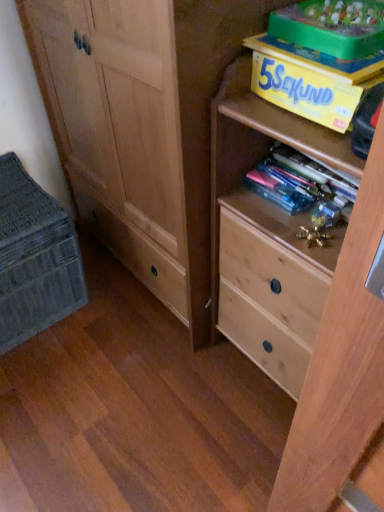
Question: Considering the relative sizes of translucent plastic books at center, placed as the 1th book when sorted from bottom to top, and green plastic storage box at upper right in the image provided, is translucent plastic books at center, placed as the 1th book when sorted from bottom to top, smaller than green plastic storage box at upper right?

Choices:
 (A) no
 (B) yes

Answer: (B)

Question: From a real-world perspective, is translucent plastic books at center, which is counted as the 2th book, starting from the top, on top of green plastic storage box at upper right?

Choices:
 (A) yes
 (B) no

Answer: (B)

Question: Is translucent plastic books at center, placed as the 1th book when sorted from bottom to top, aimed at green plastic storage box at upper right?

Choices:
 (A) yes
 (B) no

Answer: (B)

Question: Can you confirm if translucent plastic books at center, placed as the 1th book when sorted from bottom to top, is thinner than green plastic storage box at upper right?

Choices:
 (A) yes
 (B) no

Answer: (A)

Question: Can you confirm if translucent plastic books at center, which is counted as the 2th book, starting from the top, is shorter than green plastic storage box at upper right?

Choices:
 (A) no
 (B) yes

Answer: (B)

Question: From the image's perspective, is woven fabric basket at lower left positioned above or below translucent plastic books at center, placed as the 1th book when sorted from bottom to top?

Choices:
 (A) above
 (B) below

Answer: (B)

Question: In terms of width, does woven fabric basket at lower left look wider or thinner when compared to translucent plastic books at center, placed as the 1th book when sorted from bottom to top?

Choices:
 (A) wide
 (B) thin

Answer: (A)

Question: Relative to translucent plastic books at center, which is counted as the 2th book, starting from the top, is woven fabric basket at lower left in front or behind?

Choices:
 (A) behind
 (B) front

Answer: (A)

Question: Is point (66, 280) closer or farther from the camera than point (334, 211)?

Choices:
 (A) farther
 (B) closer

Answer: (A)

Question: Considering the positions of green plastic storage box at upper right and translucent plastic books at center, which is counted as the 2th book, starting from the top, in the image, is green plastic storage box at upper right taller or shorter than translucent plastic books at center, which is counted as the 2th book, starting from the top,?

Choices:
 (A) tall
 (B) short

Answer: (A)

Question: Relative to translucent plastic books at center, placed as the 1th book when sorted from bottom to top, is green plastic storage box at upper right in front or behind?

Choices:
 (A) behind
 (B) front

Answer: (B)

Question: Is green plastic storage box at upper right spatially inside translucent plastic books at center, which is counted as the 2th book, starting from the top, or outside of it?

Choices:
 (A) inside
 (B) outside

Answer: (B)

Question: In terms of size, does green plastic storage box at upper right appear bigger or smaller than translucent plastic books at center, placed as the 1th book when sorted from bottom to top?

Choices:
 (A) big
 (B) small

Answer: (A)

Question: Considering their positions, is translucent plastic books at center, placed as the 1th book when sorted from bottom to top, located in front of or behind light wood chest of drawers at right?

Choices:
 (A) front
 (B) behind

Answer: (B)

Question: Is translucent plastic books at center, placed as the 1th book when sorted from bottom to top, taller or shorter than light wood chest of drawers at right?

Choices:
 (A) tall
 (B) short

Answer: (B)